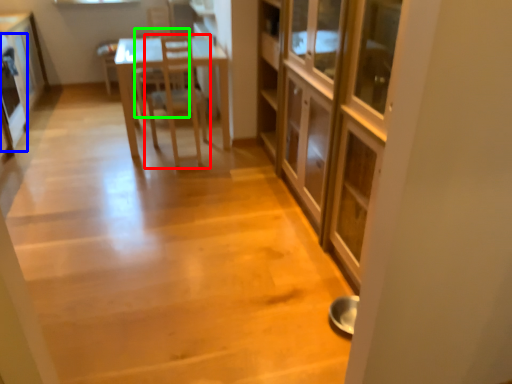
Question: Which is nearer to the chair (highlighted by a red box)? appliance (highlighted by a blue box) or armchair (highlighted by a green box).

Choices:
 (A) appliance
 (B) armchair

Answer: (B)